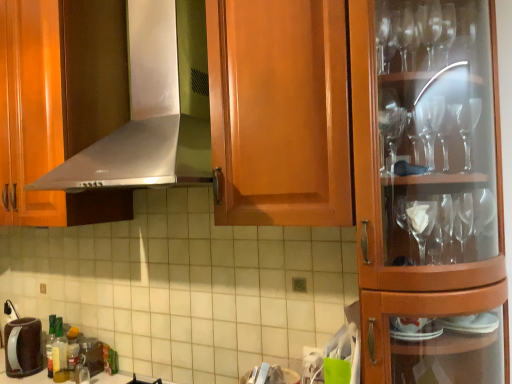
Question: Is metallic silver coffee maker at lower left, which is the second appliance in left-to-right order, behind satin silver exhaust hood at upper center?

Choices:
 (A) yes
 (B) no

Answer: (A)

Question: Is metallic silver coffee maker at lower left, which is the 1th appliance in right-to-left order, in contact with satin silver exhaust hood at upper center?

Choices:
 (A) no
 (B) yes

Answer: (A)

Question: Could you tell me if metallic silver coffee maker at lower left, which is the second appliance in left-to-right order, is turned towards satin silver exhaust hood at upper center?

Choices:
 (A) yes
 (B) no

Answer: (B)

Question: Considering the relative sizes of metallic silver coffee maker at lower left, which is the 1th appliance in right-to-left order, and satin silver exhaust hood at upper center in the image provided, is metallic silver coffee maker at lower left, which is the 1th appliance in right-to-left order, thinner than satin silver exhaust hood at upper center?

Choices:
 (A) no
 (B) yes

Answer: (B)

Question: Does metallic silver coffee maker at lower left, which is the second appliance in left-to-right order, have a greater width compared to satin silver exhaust hood at upper center?

Choices:
 (A) no
 (B) yes

Answer: (A)

Question: Does metallic silver coffee maker at lower left, which is the 1th appliance in right-to-left order, appear on the left side of satin silver exhaust hood at upper center?

Choices:
 (A) no
 (B) yes

Answer: (B)

Question: Could you tell me if metallic silver coffee maker at lower left, which is the 1th appliance in right-to-left order, is facing brushed metal faucet at lower left?

Choices:
 (A) yes
 (B) no

Answer: (B)

Question: Is metallic silver coffee maker at lower left, which is the 1th appliance in right-to-left order, next to brushed metal faucet at lower left?

Choices:
 (A) no
 (B) yes

Answer: (A)

Question: Considering the relative sizes of metallic silver coffee maker at lower left, which is the second appliance in left-to-right order, and brushed metal faucet at lower left in the image provided, is metallic silver coffee maker at lower left, which is the second appliance in left-to-right order, bigger than brushed metal faucet at lower left?

Choices:
 (A) no
 (B) yes

Answer: (B)

Question: Would you consider metallic silver coffee maker at lower left, which is the 1th appliance in right-to-left order, to be distant from brushed metal faucet at lower left?

Choices:
 (A) no
 (B) yes

Answer: (A)

Question: Can you confirm if metallic silver coffee maker at lower left, which is the 1th appliance in right-to-left order, is taller than brushed metal faucet at lower left?

Choices:
 (A) yes
 (B) no

Answer: (A)

Question: Is metallic silver coffee maker at lower left, which is the second appliance in left-to-right order, wider than brushed metal faucet at lower left?

Choices:
 (A) yes
 (B) no

Answer: (A)

Question: From the image's perspective, is satin silver exhaust hood at upper center beneath brown matte coffee pot at lower left, positioned as the second appliance in right-to-left order?

Choices:
 (A) yes
 (B) no

Answer: (B)